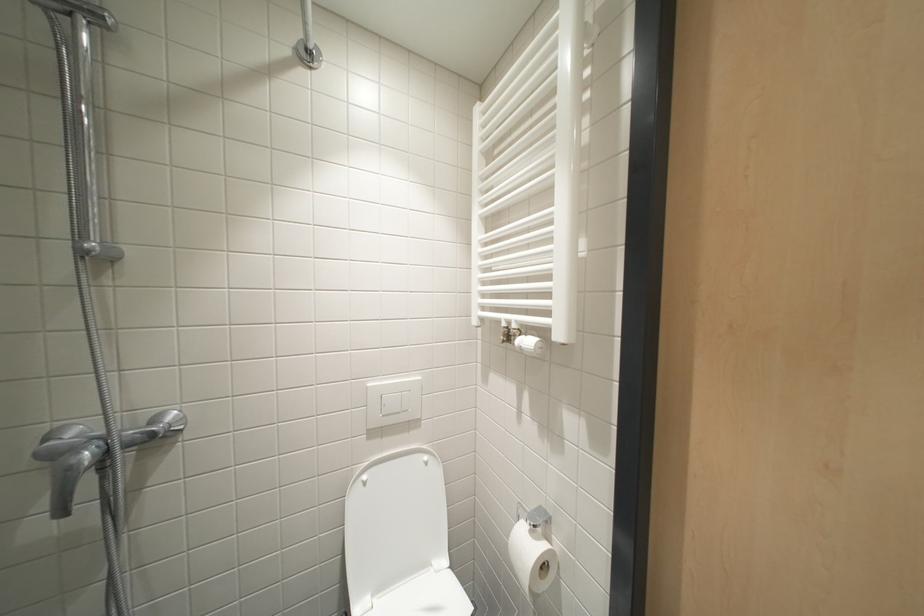
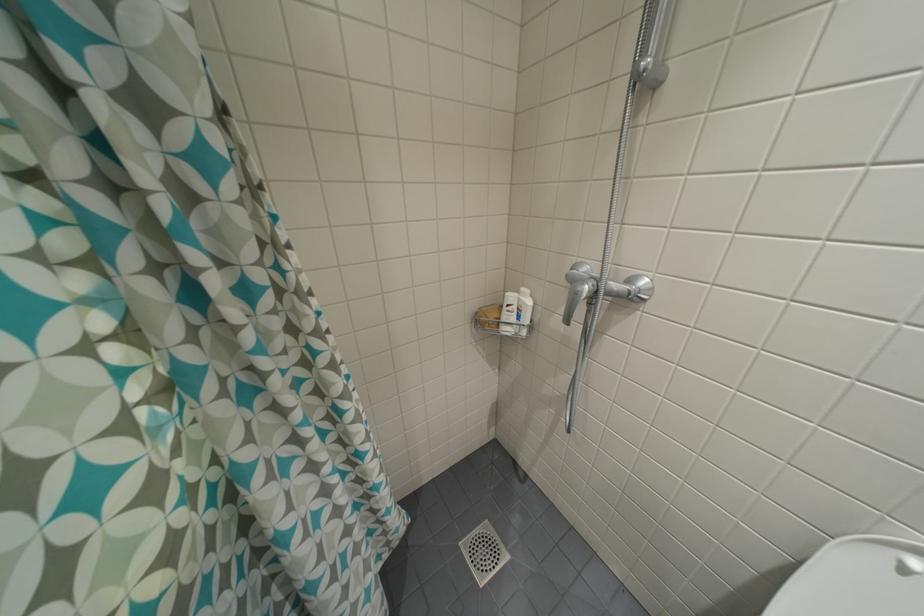
Based on the continuous images, in which direction is the camera rotating?

The camera's rotation is toward left-down.